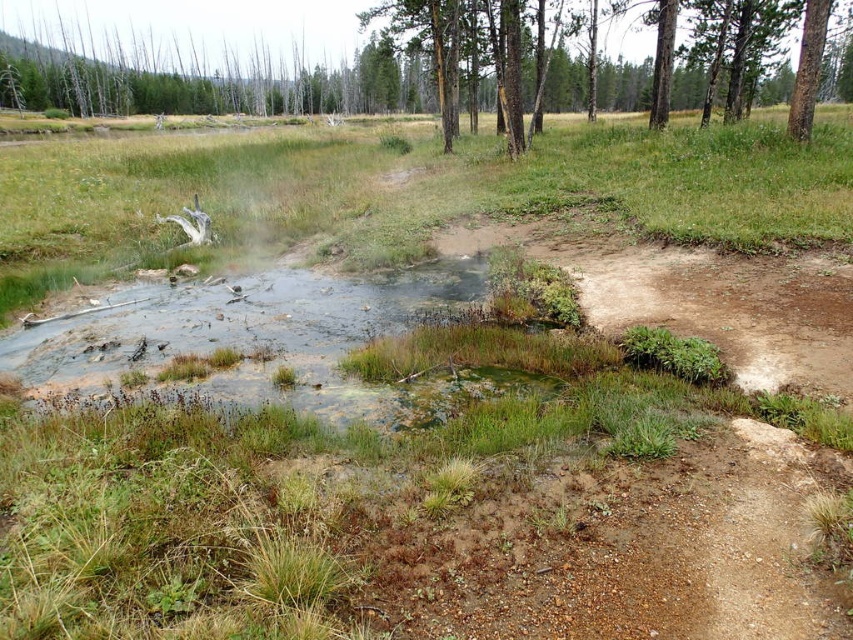
Is point (503, 120) positioned in front of point (811, 109)?

No, it is not.

The image size is (853, 640). What do you see at coordinates (735, 49) in the screenshot?
I see `green textured tree at upper center` at bounding box center [735, 49].

The width and height of the screenshot is (853, 640). In order to click on green textured tree at upper center in this screenshot , I will do `click(735, 49)`.